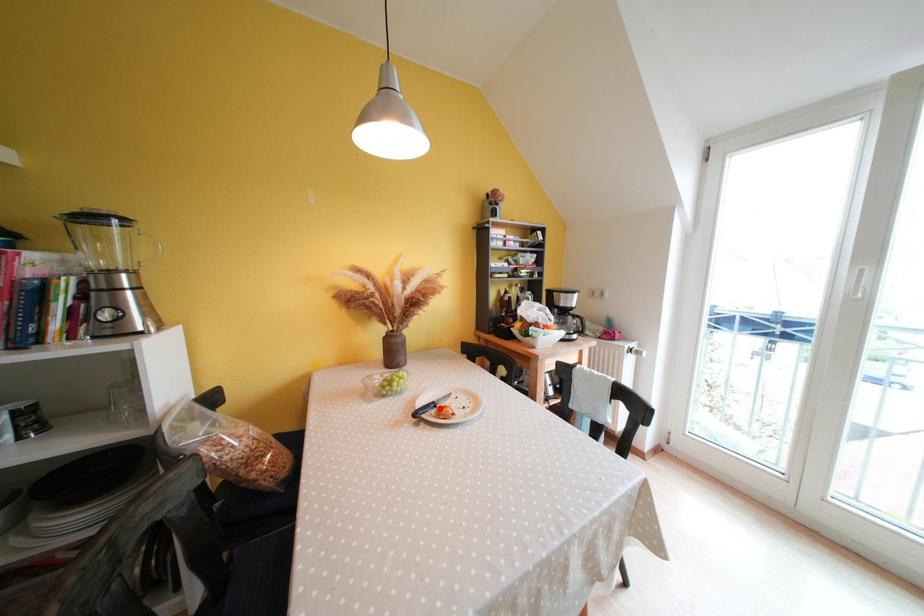
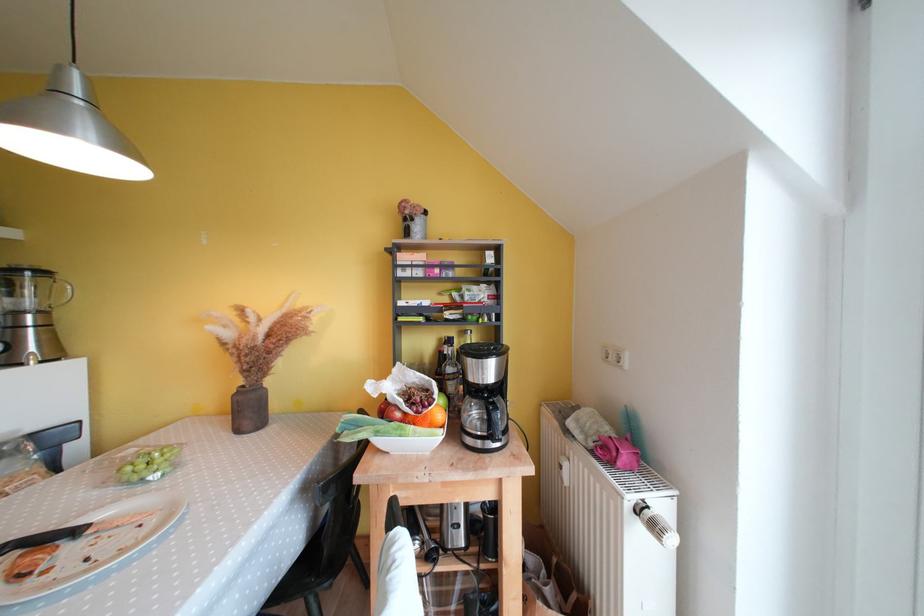
Where in the second image is the point corresponding to the highlighted location from the first image?

(83, 535)